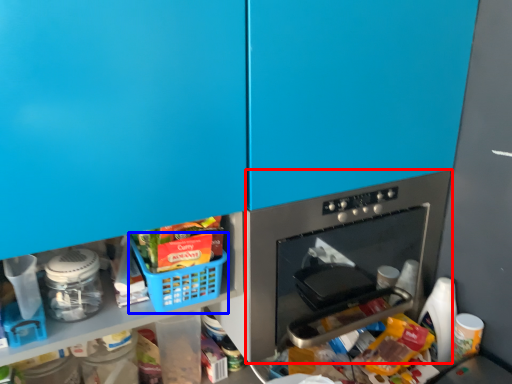
Question: Among these objects, which one is farthest to the camera, home appliance (highlighted by a red box) or basket (highlighted by a blue box)?

Choices:
 (A) home appliance
 (B) basket

Answer: (A)